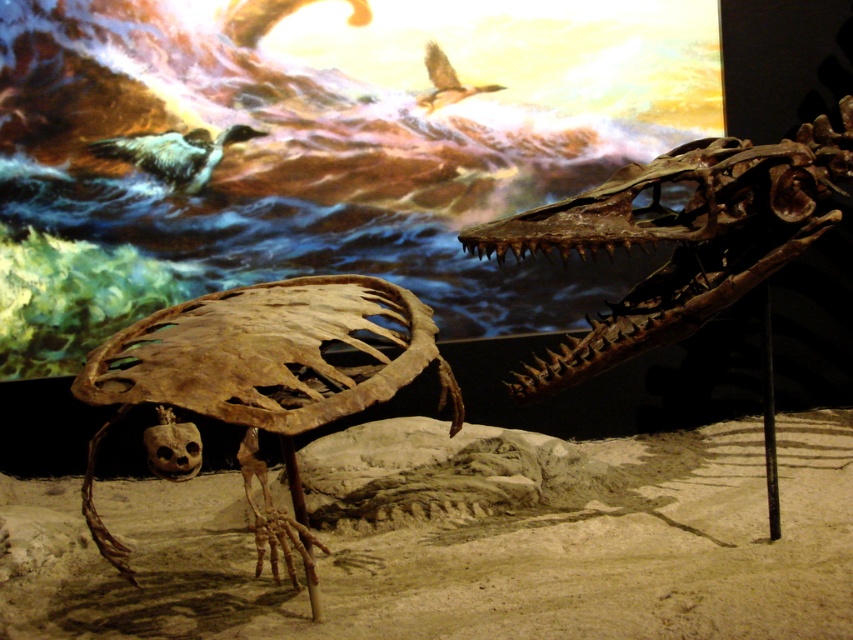
Does point (585, 346) lie in front of point (424, 54)?

Yes, point (585, 346) is in front of point (424, 54).

Can you confirm if brown bone skull at upper right is thinner than brown feathered bird at upper center?

Incorrect, brown bone skull at upper right's width is not less than brown feathered bird at upper center's.

Find the location of a particular element. brown bone skull at upper right is located at coordinates (680, 237).

Measure the distance between brown bone fossil at lower left and brown bone skull at upper right.

28.05 inches

Where is `brown bone fossil at lower left`? Image resolution: width=853 pixels, height=640 pixels. brown bone fossil at lower left is located at coordinates (263, 378).

Image resolution: width=853 pixels, height=640 pixels. I want to click on brown bone fossil at lower left, so click(x=263, y=378).

Does brown bone fossil at lower left have a lesser width compared to white feathered bird at upper left?

In fact, brown bone fossil at lower left might be wider than white feathered bird at upper left.

Who is positioned more to the left, brown bone fossil at lower left or white feathered bird at upper left?

From the viewer's perspective, white feathered bird at upper left appears more on the left side.

Identify the location of brown bone fossil at lower left. This screenshot has height=640, width=853. (263, 378).

You are a GUI agent. You are given a task and a screenshot of the screen. Output one action in this format:
    pyautogui.click(x=<x>, y=<y>)
    Task: Click on the brown bone fossil at lower left
    This screenshot has height=640, width=853.
    Given the screenshot: What is the action you would take?
    tap(263, 378)